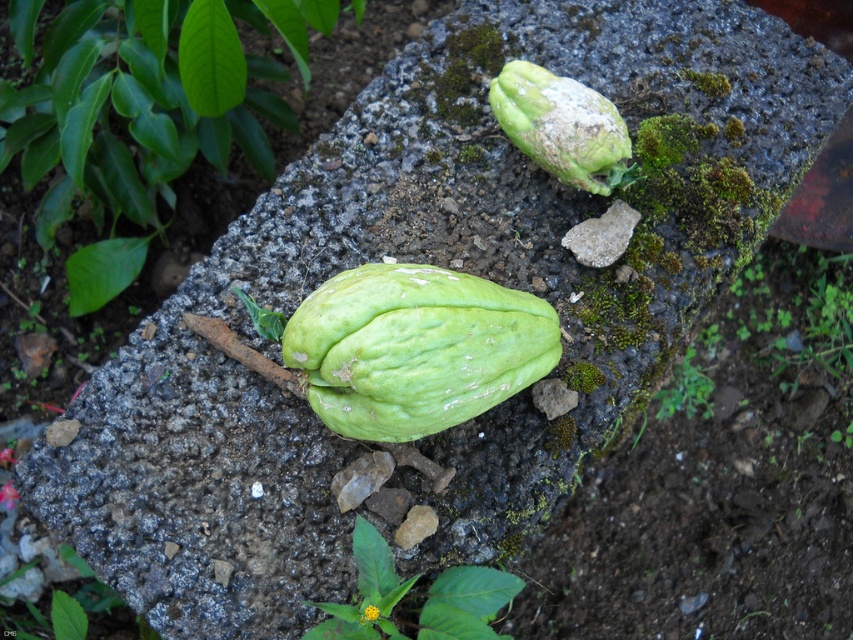
Is point (431, 616) closer to camera compared to point (368, 609)?

That is False.

Does point (447, 637) come closer to viewer compared to point (373, 618)?

No, (447, 637) is behind (373, 618).

Locate an element on the screen. This screenshot has width=853, height=640. green rough leaf at lower center is located at coordinates (465, 602).

Can you confirm if green rough fruit at center is positioned to the left of green rough leaf at lower right?

Yes, green rough fruit at center is to the left of green rough leaf at lower right.

Can you confirm if green rough fruit at center is positioned above green rough leaf at lower right?

Correct, green rough fruit at center is located above green rough leaf at lower right.

Who is more forward, (138, 241) or (672, 401)?

Point (138, 241) is more forward.

Identify the location of green rough fruit at center. The image size is (853, 640). (144, 113).

Where is `green rough fruit at center`? green rough fruit at center is located at coordinates (144, 113).

Who is more forward, (96, 102) or (624, 184)?

Point (624, 184)

Locate an element on the screen. The height and width of the screenshot is (640, 853). green rough fruit at center is located at coordinates (144, 113).